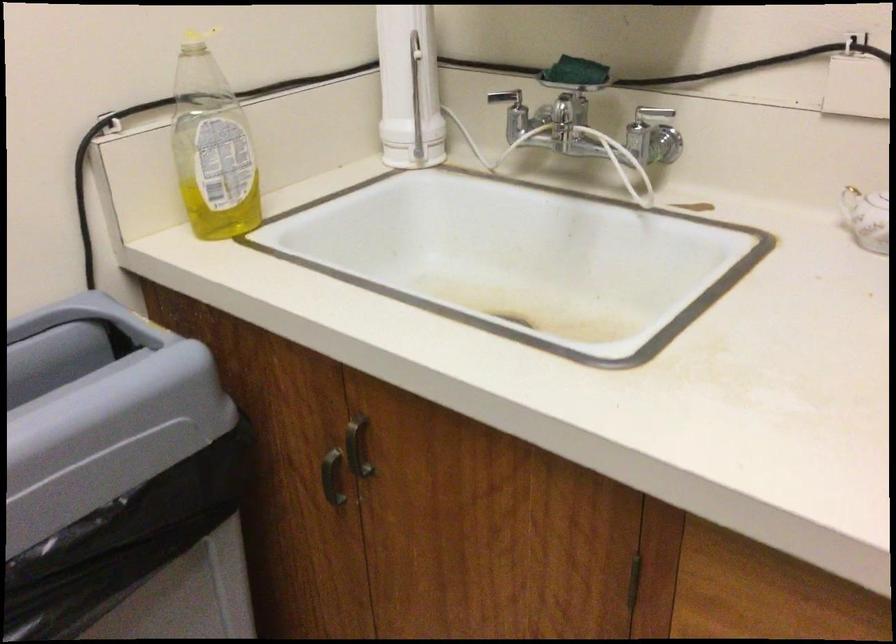
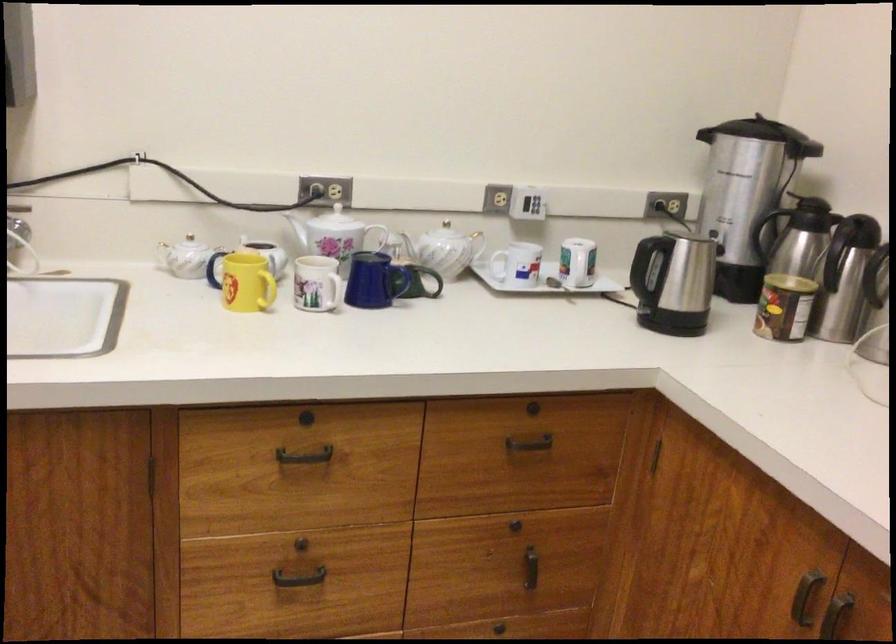
Question: The camera is either moving clockwise (left) or counter-clockwise (right) around the object. The first image is from the beginning of the video and the second image is from the end. Is the camera moving left or right when shooting the video?

Choices:
 (A) Left
 (B) Right

Answer: (A)